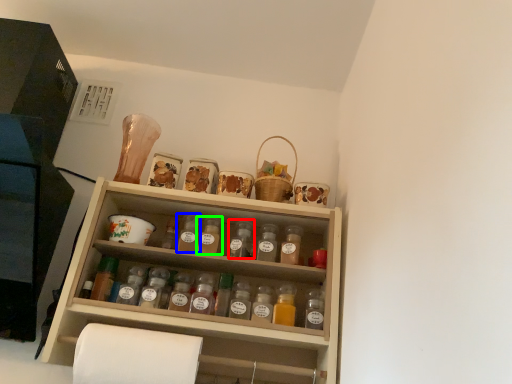
Question: Which object is positioned closest to bottle (highlighted by a red box)? Select from bottle (highlighted by a blue box) and bottle (highlighted by a green box).

Choices:
 (A) bottle
 (B) bottle

Answer: (B)